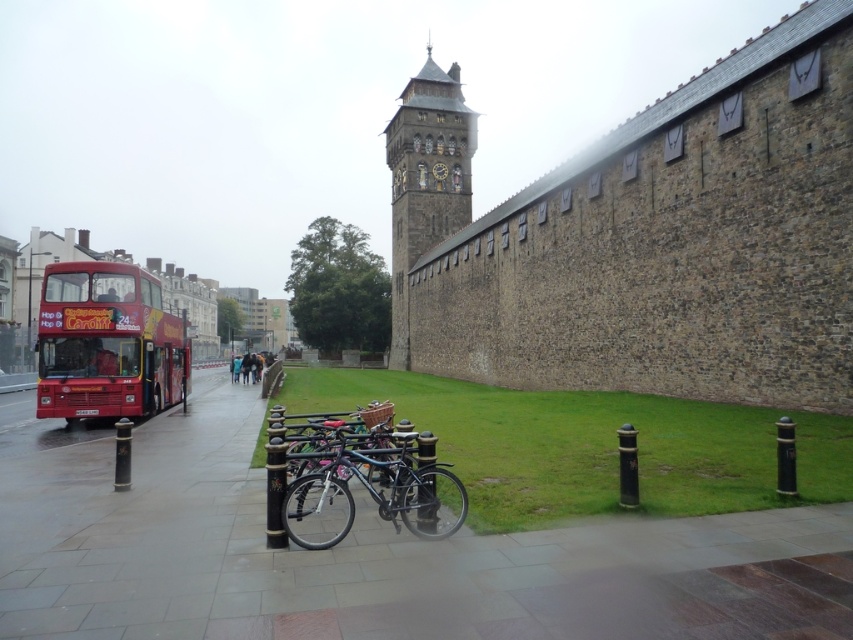
Question: Considering the real-world distances, which object is closest to the smooth concrete pavement at center?

Choices:
 (A) shiny metallic bicycle at center
 (B) stone clock tower at upper center
 (C) red matte double-decker bus at left

Answer: (A)

Question: Can you confirm if red matte double-decker bus at left is thinner than shiny metallic bicycle at center?

Choices:
 (A) no
 (B) yes

Answer: (A)

Question: Which point is closer to the camera?

Choices:
 (A) (555, 570)
 (B) (111, 268)
 (C) (318, 481)

Answer: (A)

Question: Can you confirm if stone clock tower at upper center is positioned to the right of shiny metallic bicycle at center?

Choices:
 (A) yes
 (B) no

Answer: (A)

Question: Among these points, which one is nearest to the camera?

Choices:
 (A) (451, 180)
 (B) (334, 467)

Answer: (B)

Question: Is stone clock tower at upper center to the right of shiny metallic bicycle at center from the viewer's perspective?

Choices:
 (A) no
 (B) yes

Answer: (B)